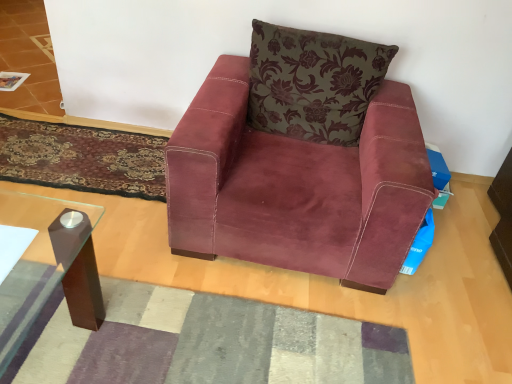
Where is `free space to the left of suede-like burgundy armchair at center`? The height and width of the screenshot is (384, 512). free space to the left of suede-like burgundy armchair at center is located at coordinates (100, 197).